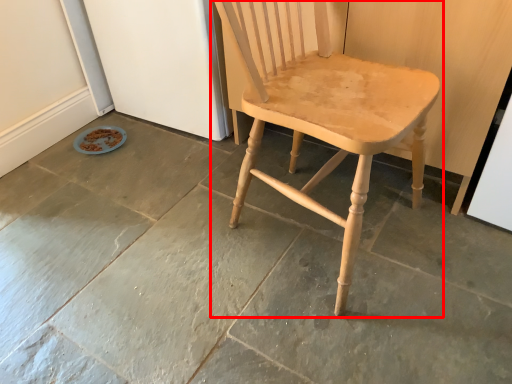
Question: From the image's perspective, considering the relative positions of chair (annotated by the red box) and concrete in the image provided, where is chair (annotated by the red box) located with respect to the staircase?

Choices:
 (A) below
 (B) above

Answer: (B)